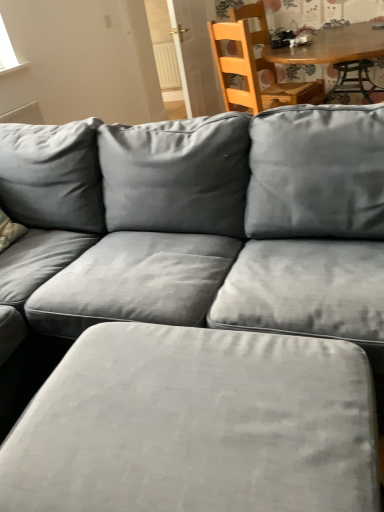
Question: Is suede gray ottoman at lower center to the left of white plastic radiator at upper center from the viewer's perspective?

Choices:
 (A) no
 (B) yes

Answer: (A)

Question: Is suede gray ottoman at lower center outside of white plastic radiator at upper center?

Choices:
 (A) yes
 (B) no

Answer: (A)

Question: From the image's perspective, does suede gray ottoman at lower center appear lower than white plastic radiator at upper center?

Choices:
 (A) yes
 (B) no

Answer: (A)

Question: Considering the relative sizes of suede gray ottoman at lower center and white plastic radiator at upper center in the image provided, is suede gray ottoman at lower center taller than white plastic radiator at upper center?

Choices:
 (A) yes
 (B) no

Answer: (B)

Question: From the image's perspective, would you say suede gray ottoman at lower center is positioned over white plastic radiator at upper center?

Choices:
 (A) no
 (B) yes

Answer: (A)

Question: In terms of size, does wooden table at upper center appear bigger or smaller than wooden chair at upper right?

Choices:
 (A) small
 (B) big

Answer: (B)

Question: Relative to wooden chair at upper right, is wooden table at upper center in front or behind?

Choices:
 (A) behind
 (B) front

Answer: (B)

Question: Considering the positions of point (367, 22) and point (256, 16), is point (367, 22) closer or farther from the camera than point (256, 16)?

Choices:
 (A) closer
 (B) farther

Answer: (A)

Question: From a real-world perspective, relative to wooden chair at upper right, is wooden table at upper center vertically above or below?

Choices:
 (A) below
 (B) above

Answer: (A)

Question: Considering the positions of wooden chair at upper right and wooden table at upper center in the image, is wooden chair at upper right bigger or smaller than wooden table at upper center?

Choices:
 (A) big
 (B) small

Answer: (B)

Question: From a real-world perspective, is wooden chair at upper right positioned above or below wooden table at upper center?

Choices:
 (A) above
 (B) below

Answer: (A)

Question: Considering the positions of wooden chair at upper right and wooden table at upper center in the image, is wooden chair at upper right wider or thinner than wooden table at upper center?

Choices:
 (A) thin
 (B) wide

Answer: (A)

Question: From their relative heights in the image, would you say wooden chair at upper right is taller or shorter than wooden table at upper center?

Choices:
 (A) short
 (B) tall

Answer: (B)

Question: Considering the positions of white plastic radiator at upper center and suede gray ottoman at lower center in the image, is white plastic radiator at upper center taller or shorter than suede gray ottoman at lower center?

Choices:
 (A) tall
 (B) short

Answer: (A)

Question: Would you say white plastic radiator at upper center is to the left or to the right of suede gray ottoman at lower center in the picture?

Choices:
 (A) right
 (B) left

Answer: (B)